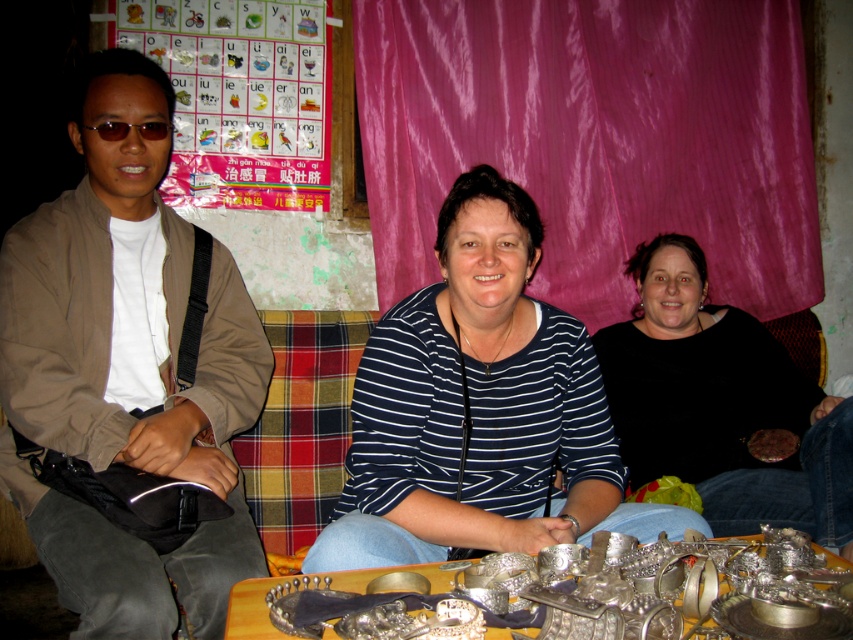
You are a photographer setting up a shoot in this scene. You need to place a small prop that must be visible above both the blue striped shirt at center and the metallic silver jewelry at lower center. Based on their heights, where should you position the prop?

The blue striped shirt at center is taller than the metallic silver jewelry at lower center. To ensure the prop is visible above both, position it above the blue striped shirt at center, as it is the taller object.

Based on the scene described, can you determine the spatial relationship between the brown fabric jacket at left and the other objects in the image?

The brown fabric jacket at left is located at point coordinates, but without additional object coordinates, I cannot determine its spatial relationship to other objects.

You are a photographer trying to capture a closeup of the metallic silver jewelry at lower center without the blue striped shirt at center blocking the view. Is the jewelry small enough to frame without the shirt overlapping?

The blue striped shirt at center is larger in size than metallic silver jewelry at lower center, so the jewelry is smaller and may be framed without the shirt overlapping if positioned carefully.